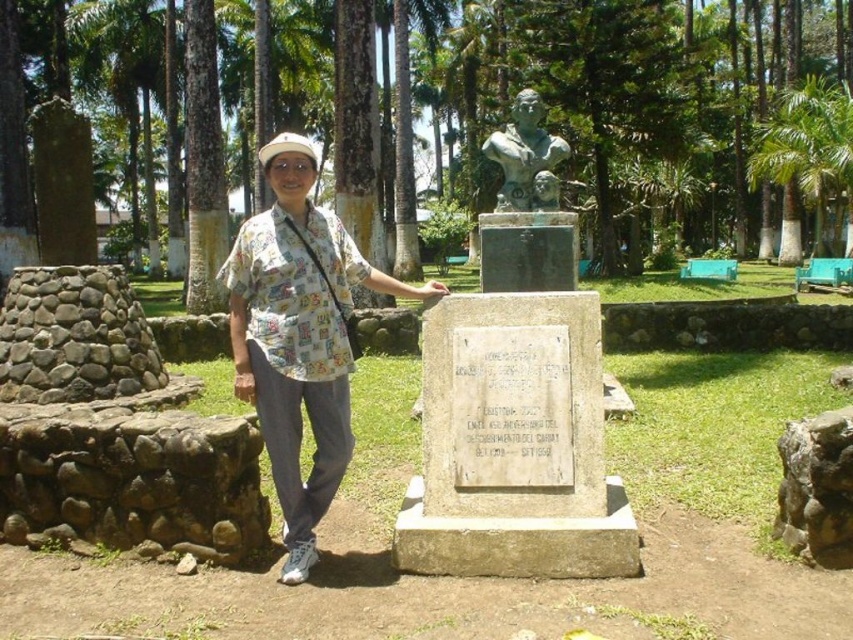
Question: Does green leafy palm tree at upper right have a lesser width compared to bronze bust at center?

Choices:
 (A) yes
 (B) no

Answer: (B)

Question: Estimate the real-world distances between objects in this image. Which object is closer to the bronze bust at center?

Choices:
 (A) green leafy palm tree at upper right
 (B) printed cotton shirt at center
 (C) green leafy palm tree at upper left

Answer: (B)

Question: Does green leafy palm tree at upper left appear on the right side of bronze bust at center?

Choices:
 (A) no
 (B) yes

Answer: (A)

Question: Does green leafy palm tree at upper left appear under bronze bust at center?

Choices:
 (A) no
 (B) yes

Answer: (A)

Question: Which point is farther from the camera taking this photo?

Choices:
 (A) (816, 195)
 (B) (541, 182)
 (C) (286, 180)

Answer: (A)

Question: Which point is closer to the camera taking this photo?

Choices:
 (A) (808, 170)
 (B) (523, 156)

Answer: (B)